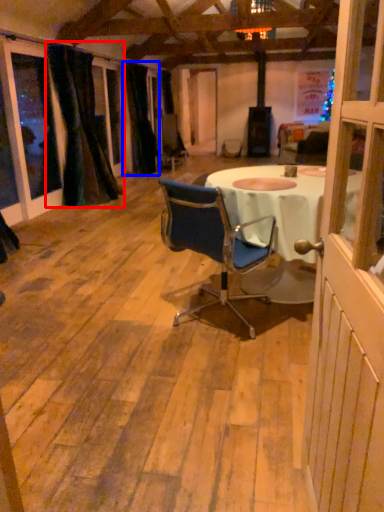
Question: Which point is closer to the camera, curtain (highlighted by a red box) or curtain (highlighted by a blue box)?

Choices:
 (A) curtain
 (B) curtain

Answer: (A)